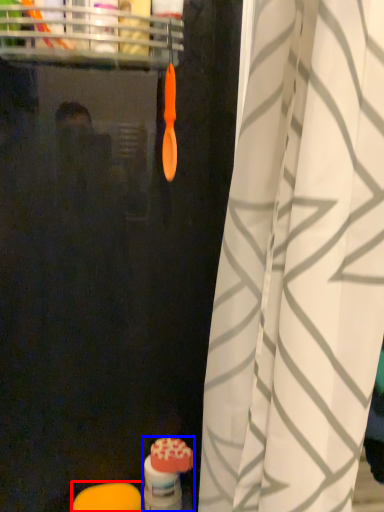
Question: Which point is closer to the camera, soap (highlighted by a red box) or toiletry (highlighted by a blue box)?

Choices:
 (A) soap
 (B) toiletry

Answer: (A)